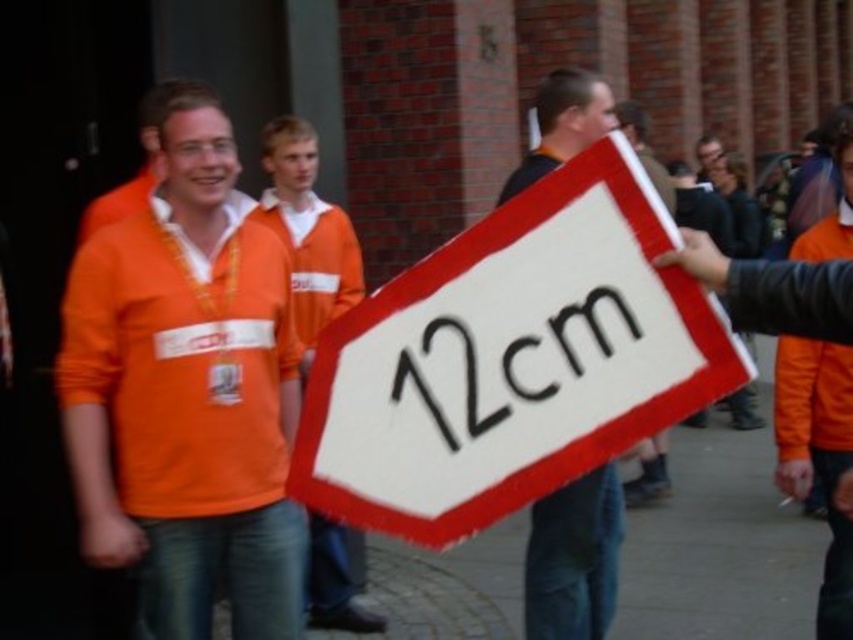
Question: Can you confirm if orange jersey at center is positioned above white fabric sign at center?

Choices:
 (A) no
 (B) yes

Answer: (B)

Question: Does orange jersey at center have a lesser width compared to white fabric sign at center?

Choices:
 (A) yes
 (B) no

Answer: (B)

Question: Can you confirm if orange jersey at center is wider than white fabric sign at center?

Choices:
 (A) yes
 (B) no

Answer: (A)

Question: Which is nearer to the white felt sign at center?

Choices:
 (A) orange jersey at center
 (B) white fabric sign at center

Answer: (A)

Question: Which object is closer to the camera taking this photo?

Choices:
 (A) white fabric sign at center
 (B) orange jersey at center

Answer: (B)

Question: Which is farther from the white felt sign at center?

Choices:
 (A) white fabric sign at center
 (B) orange jersey at center

Answer: (A)